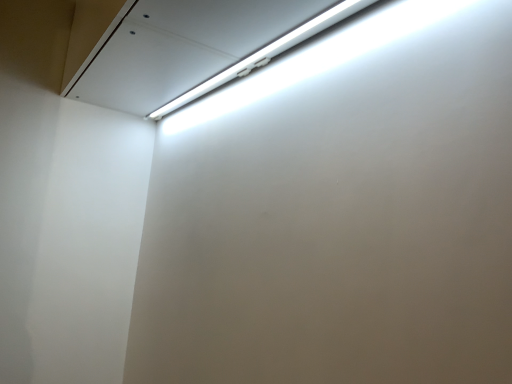
Question: Should I look upward or downward to see white fluorescent tube at upper center?

Choices:
 (A) up
 (B) down

Answer: (A)